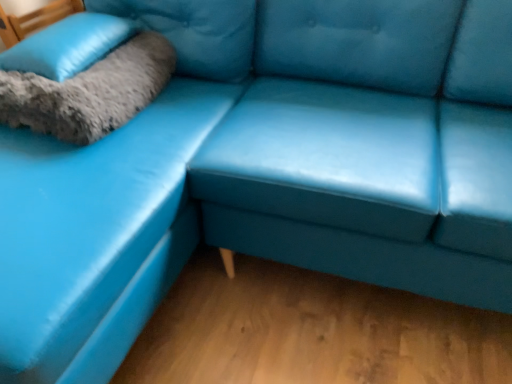
Question: Considering the relative positions of soft gray fur pillow at upper left and gray fluffy pillow at upper left in the image provided, is soft gray fur pillow at upper left to the left or to the right of gray fluffy pillow at upper left?

Choices:
 (A) left
 (B) right

Answer: (A)

Question: Is soft gray fur pillow at upper left inside or outside of gray fluffy pillow at upper left?

Choices:
 (A) inside
 (B) outside

Answer: (B)

Question: Which object is the closest to the matte blue leather couch at center?

Choices:
 (A) soft gray fur pillow at upper left
 (B) gray fluffy pillow at upper left

Answer: (B)

Question: Considering the real-world distances, which object is farthest from the soft gray fur pillow at upper left?

Choices:
 (A) gray fluffy pillow at upper left
 (B) matte blue leather couch at center

Answer: (B)